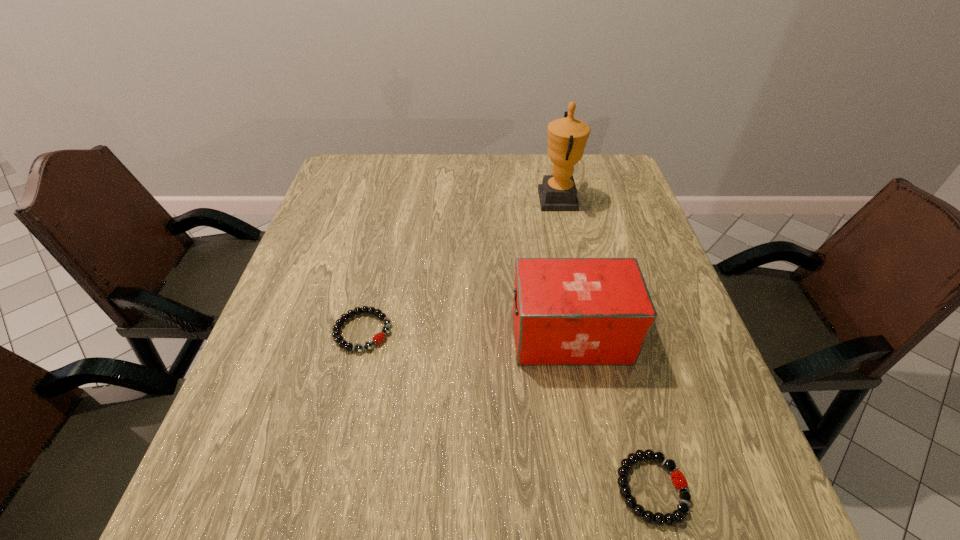
What are the coordinates of `the farthest object` in the screenshot? It's located at (567, 137).

This screenshot has height=540, width=960. I want to click on the tallest object, so click(x=567, y=137).

Find the location of a particular element. the third shortest object is located at coordinates (567, 311).

The image size is (960, 540). Find the location of `the left bracelet`. the left bracelet is located at coordinates (378, 338).

You are a GUI agent. You are given a task and a screenshot of the screen. Output one action in this format:
    pyautogui.click(x=<x>, y=<y>)
    Task: Click on the farther bracelet
    Image resolution: width=960 pixels, height=540 pixels.
    Given the screenshot: What is the action you would take?
    pyautogui.click(x=378, y=338)

Identify the location of the nearest object. (678, 479).

The width and height of the screenshot is (960, 540). Find the location of `the nearer bracelet`. the nearer bracelet is located at coordinates (678, 479).

This screenshot has width=960, height=540. What are the coordinates of `blank area located 0.190m at the front of the award with handles` in the screenshot? It's located at (473, 199).

Find the location of a particular element. blank space located 0.340m at the front of the award with handles is located at coordinates (421, 199).

I want to click on free space located at the front of the award with handles, so click(432, 199).